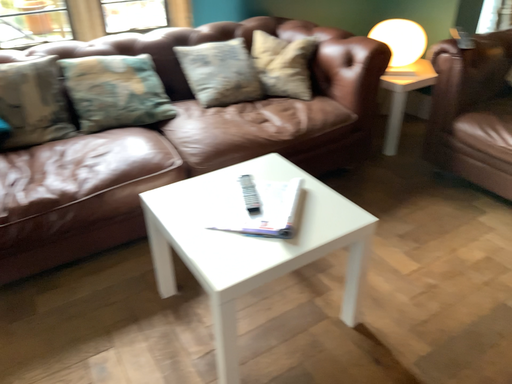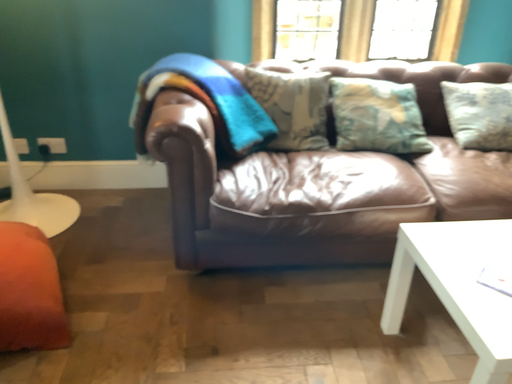
Question: Which way did the camera rotate in the video?

Choices:
 (A) rotated right
 (B) rotated left

Answer: (B)